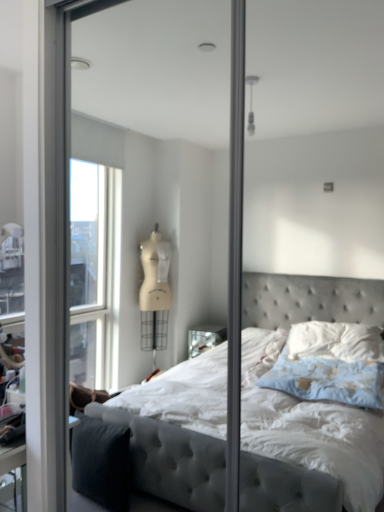
What do you see at coordinates (169, 207) in the screenshot?
I see `transparent glass screen door at center` at bounding box center [169, 207].

Locate an element on the screen. This screenshot has width=384, height=512. transparent glass screen door at center is located at coordinates (169, 207).

Find the location of `transparent glass screen door at center`. transparent glass screen door at center is located at coordinates (169, 207).